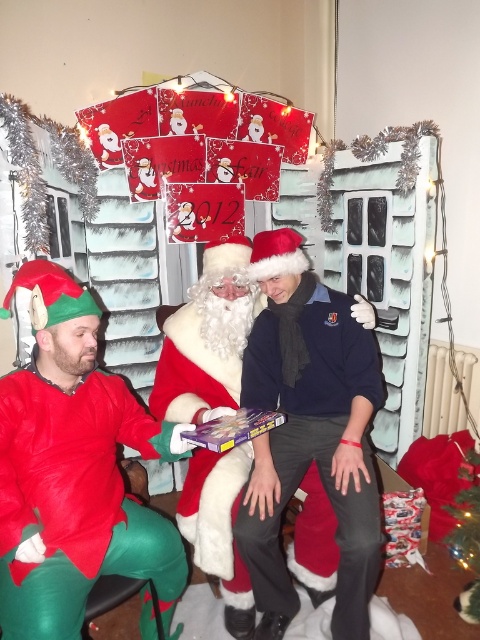
Who is more forward, (28, 529) or (35, 280)?

Point (28, 529) is in front.

Which is more to the right, velvet red elf costume at left or matte red santa suit at center?

Positioned to the right is matte red santa suit at center.

Who is more forward, (121, 496) or (141, 452)?

Point (121, 496) is in front.

Locate an element on the screen. This screenshot has width=480, height=640. velvet red elf costume at left is located at coordinates (73, 472).

Can you confirm if dark blue sweater at center is thinner than matte red santa suit at center?

Indeed, dark blue sweater at center has a lesser width compared to matte red santa suit at center.

Based on the photo, how far apart are dark blue sweater at center and matte red santa suit at center?

dark blue sweater at center is 26.42 centimeters from matte red santa suit at center.

Which is behind, point (292, 419) or point (52, 333)?

Positioned behind is point (292, 419).

Find the location of a particular element. dark blue sweater at center is located at coordinates (309, 433).

Is velvet red elf costume at left taller than white fluffy santa at center?

No.

Who is taller, velvet red elf costume at left or white fluffy santa at center?

With more height is white fluffy santa at center.

Which is in front, point (120, 417) or point (194, 534)?

Point (120, 417) is in front.

Image resolution: width=480 pixels, height=640 pixels. What are the coordinates of `velvet red elf costume at left` in the screenshot? It's located at (73, 472).